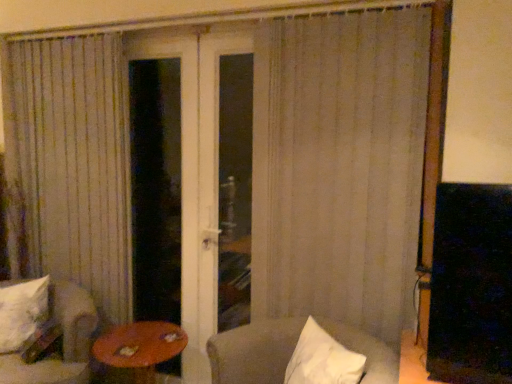
Question: Can you confirm if white fabric chair at lower left, which is the first chair from left to right, is thinner than white soft pillow at lower left?

Choices:
 (A) no
 (B) yes

Answer: (A)

Question: Does white fabric chair at lower left, which is the first chair from left to right, have a smaller size compared to white soft pillow at lower left?

Choices:
 (A) no
 (B) yes

Answer: (A)

Question: Considering the relative sizes of white fabric chair at lower left, which is the first chair from left to right, and white soft pillow at lower left in the image provided, is white fabric chair at lower left, which is the first chair from left to right, bigger than white soft pillow at lower left?

Choices:
 (A) yes
 (B) no

Answer: (A)

Question: Does white fabric chair at lower left, which is the first chair from left to right, lie in front of white soft pillow at lower left?

Choices:
 (A) no
 (B) yes

Answer: (B)

Question: From the image's perspective, would you say white fabric chair at lower left, which is the first chair from left to right, is shown under white soft pillow at lower left?

Choices:
 (A) no
 (B) yes

Answer: (B)

Question: In terms of width, does white fabric chair at lower right, acting as the first chair starting from the right, look wider or thinner when compared to transparent glass door at center?

Choices:
 (A) wide
 (B) thin

Answer: (A)

Question: Is white fabric chair at lower right, placed as the second chair when sorted from left to right, inside or outside of transparent glass door at center?

Choices:
 (A) outside
 (B) inside

Answer: (A)

Question: In terms of height, does white fabric chair at lower right, acting as the first chair starting from the right, look taller or shorter compared to transparent glass door at center?

Choices:
 (A) tall
 (B) short

Answer: (B)

Question: Considering their positions, is white fabric chair at lower right, acting as the first chair starting from the right, located in front of or behind transparent glass door at center?

Choices:
 (A) behind
 (B) front

Answer: (B)

Question: Is wooden round table at lower left spatially inside white soft pillow at lower left, or outside of it?

Choices:
 (A) outside
 (B) inside

Answer: (A)

Question: From a real-world perspective, is wooden round table at lower left positioned above or below white soft pillow at lower left?

Choices:
 (A) above
 (B) below

Answer: (B)

Question: Visually, is wooden round table at lower left positioned to the left or to the right of white soft pillow at lower left?

Choices:
 (A) left
 (B) right

Answer: (B)

Question: From the image's perspective, relative to white soft pillow at lower left, is wooden round table at lower left above or below?

Choices:
 (A) above
 (B) below

Answer: (B)

Question: From a real-world perspective, relative to white fabric chair at lower right, acting as the first chair starting from the right, is wooden round table at lower left vertically above or below?

Choices:
 (A) below
 (B) above

Answer: (A)

Question: Is wooden round table at lower left taller or shorter than white fabric chair at lower right, placed as the second chair when sorted from left to right?

Choices:
 (A) tall
 (B) short

Answer: (B)